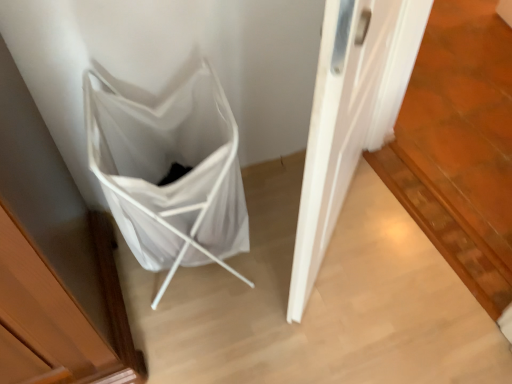
Question: In terms of height, does white matte door at center look taller or shorter compared to white fabric folding chair at lower left?

Choices:
 (A) tall
 (B) short

Answer: (A)

Question: From the image's perspective, relative to white fabric folding chair at lower left, is white matte door at center above or below?

Choices:
 (A) below
 (B) above

Answer: (B)

Question: Looking at their shapes, would you say white matte door at center is wider or thinner than white fabric folding chair at lower left?

Choices:
 (A) thin
 (B) wide

Answer: (A)

Question: From a real-world perspective, is white fabric folding chair at lower left physically located above or below white matte door at center?

Choices:
 (A) above
 (B) below

Answer: (B)

Question: Is white fabric folding chair at lower left taller or shorter than white matte door at center?

Choices:
 (A) tall
 (B) short

Answer: (B)

Question: Is white fabric folding chair at lower left wider or thinner than white matte door at center?

Choices:
 (A) wide
 (B) thin

Answer: (A)

Question: Looking at the image, does white fabric folding chair at lower left seem bigger or smaller compared to white matte door at center?

Choices:
 (A) big
 (B) small

Answer: (B)